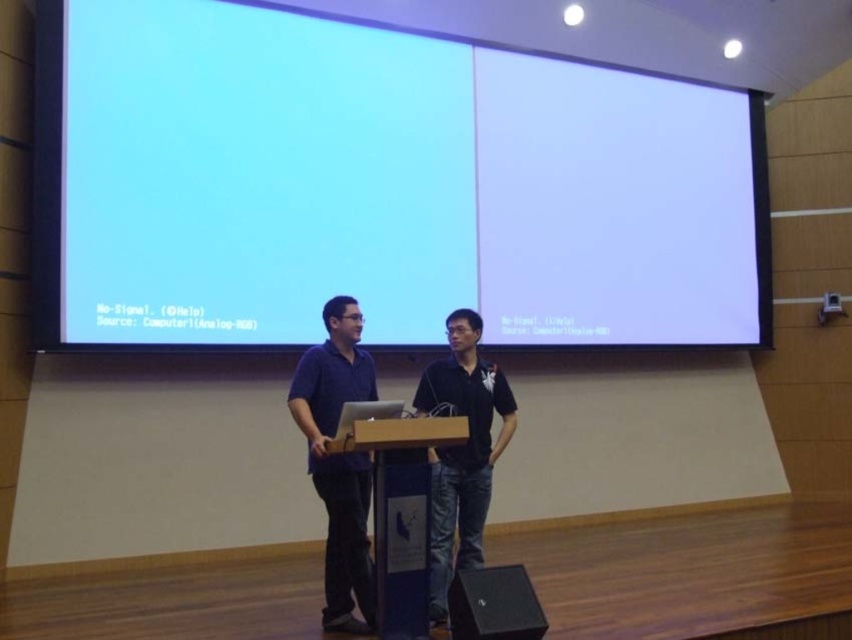
Question: Which of the following is the closest to the observer?

Choices:
 (A) black matte speaker at lower right
 (B) black matte shirt at center
 (C) blue plastic podium at center

Answer: (A)

Question: Does white matte projection screen at upper center have a greater width compared to blue plastic podium at center?

Choices:
 (A) yes
 (B) no

Answer: (A)

Question: In this image, where is white matte projection screen at upper center located relative to black matte speaker at lower right?

Choices:
 (A) right
 (B) left

Answer: (B)

Question: Among these objects, which one is farthest from the camera?

Choices:
 (A) blue plastic podium at center
 (B) dark blue shirt at center
 (C) white matte projection screen at upper center
 (D) black matte shirt at center

Answer: (C)

Question: Among these points, which one is nearest to the camera?

Choices:
 (A) (459, 608)
 (B) (461, 172)
 (C) (318, 406)
 (D) (461, 550)

Answer: (A)

Question: Does blue plastic podium at center have a larger size compared to black matte speaker at lower right?

Choices:
 (A) yes
 (B) no

Answer: (A)